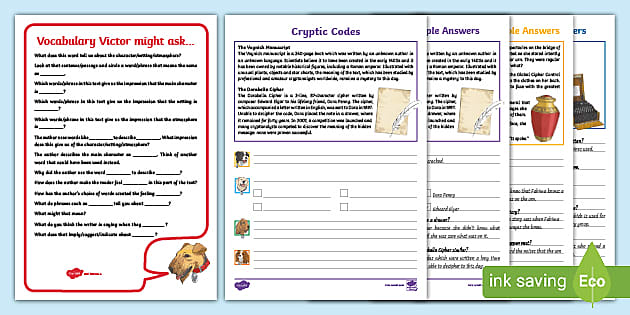
Where is `paper and quill`? This screenshot has width=630, height=315. paper and quill is located at coordinates (382, 105).